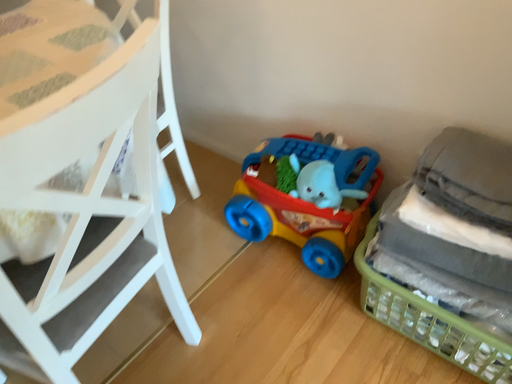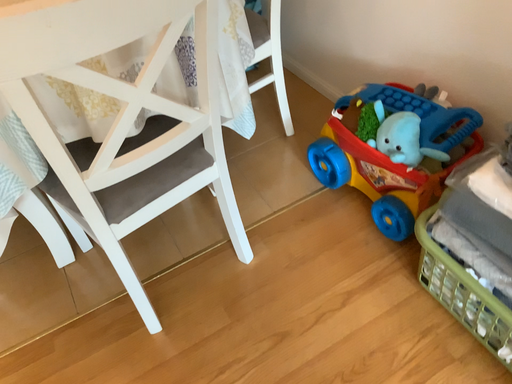
Question: How did the camera likely rotate when shooting the video?

Choices:
 (A) rotated left
 (B) rotated right

Answer: (A)